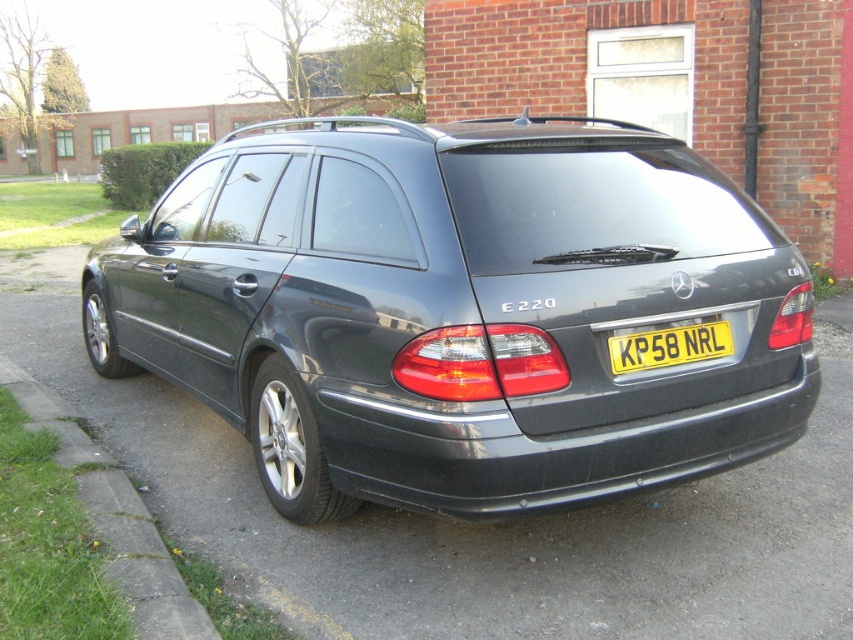
Does satin black station wagon at center have a lesser width compared to yellow metallic license plate at center?

Yes.

Describe the element at coordinates (459, 310) in the screenshot. I see `satin black station wagon at center` at that location.

Image resolution: width=853 pixels, height=640 pixels. I want to click on satin black station wagon at center, so click(x=459, y=310).

Does satin black station wagon at center have a greater height compared to green grass at lower left?

In fact, satin black station wagon at center may be shorter than green grass at lower left.

Is satin black station wagon at center positioned in front of green grass at lower left?

No, satin black station wagon at center is further to the viewer.

Find the location of a particular element. This screenshot has height=640, width=853. satin black station wagon at center is located at coordinates (459, 310).

Find the location of a particular element. Image resolution: width=853 pixels, height=640 pixels. satin black station wagon at center is located at coordinates (459, 310).

Who is positioned more to the left, green grass at lower left or yellow metallic license plate at center?

From the viewer's perspective, green grass at lower left appears more on the left side.

Is green grass at lower left taller than yellow metallic license plate at center?

Yes, green grass at lower left is taller than yellow metallic license plate at center.

Image resolution: width=853 pixels, height=640 pixels. Find the location of `green grass at lower left`. green grass at lower left is located at coordinates (115, 518).